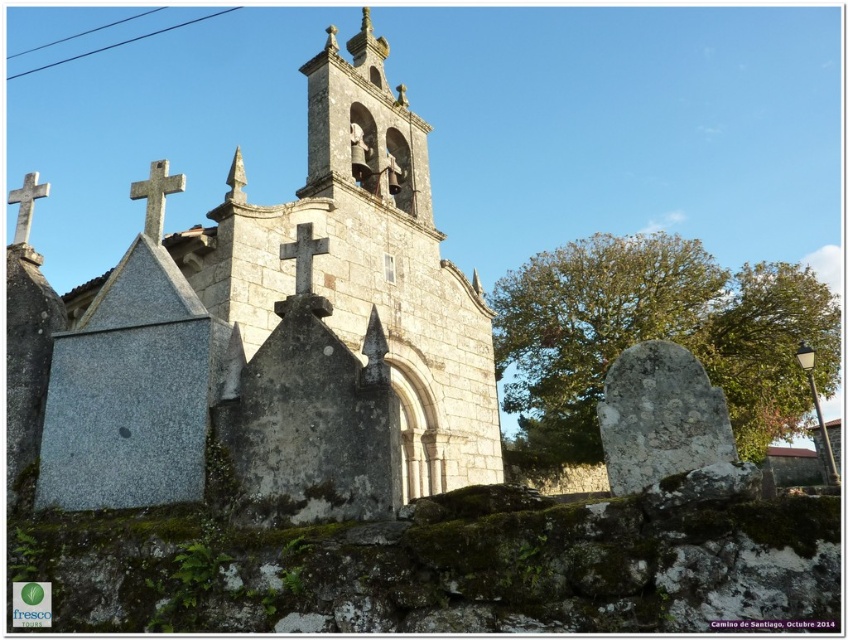
Question: Among these objects, which one is farthest from the camera?

Choices:
 (A) granite church at center
 (B) white stone cross at upper left

Answer: (B)

Question: Is black stone cross at center thinner than white stone cross at upper left?

Choices:
 (A) yes
 (B) no

Answer: (A)

Question: Considering the relative positions of white stone cross at upper center and black stone cross at center in the image provided, where is white stone cross at upper center located with respect to black stone cross at center?

Choices:
 (A) below
 (B) above

Answer: (B)

Question: Which object is farther from the camera taking this photo?

Choices:
 (A) white stone cross at upper center
 (B) gray stone gravestone at center

Answer: (A)

Question: Which point appears closest to the camera in this image?

Choices:
 (A) (427, 433)
 (B) (21, 202)
 (C) (298, 236)

Answer: (C)

Question: In this image, where is gray stone gravestone at center located relative to black stone cross at center?

Choices:
 (A) left
 (B) right

Answer: (B)